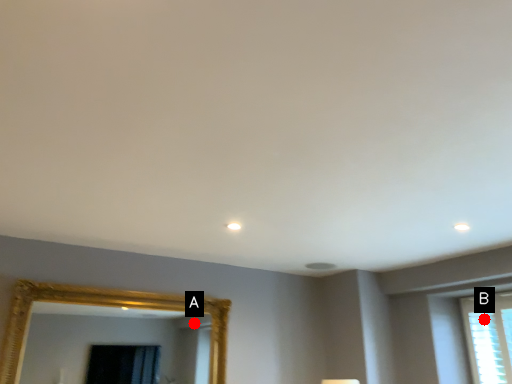
Question: Two points are circled on the image, labeled by A and B beside each circle. Among these points, which one is farthest from the camera?

Choices:
 (A) A is further
 (B) B is further

Answer: (A)